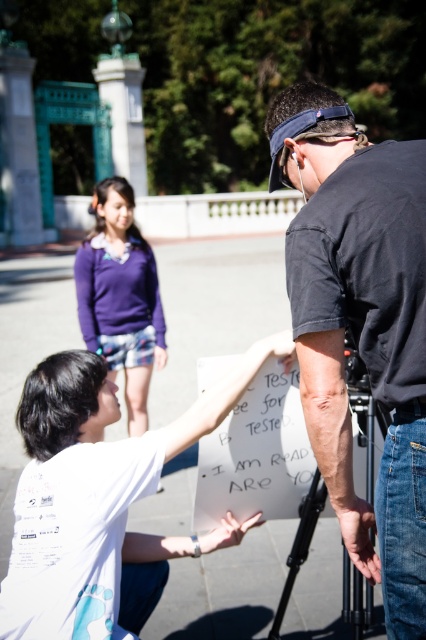
You are a photographer trying to capture a candid shot of the purple fabric shorts at center without including the black matte shirt at center in the frame. Based on their positions, is this possible?

The black matte shirt at center is in front of the purple fabric shorts at center, so it would block the view of the purple fabric shorts at center. Therefore, capturing the purple fabric shorts at center without the black matte shirt at center in the frame is not possible.